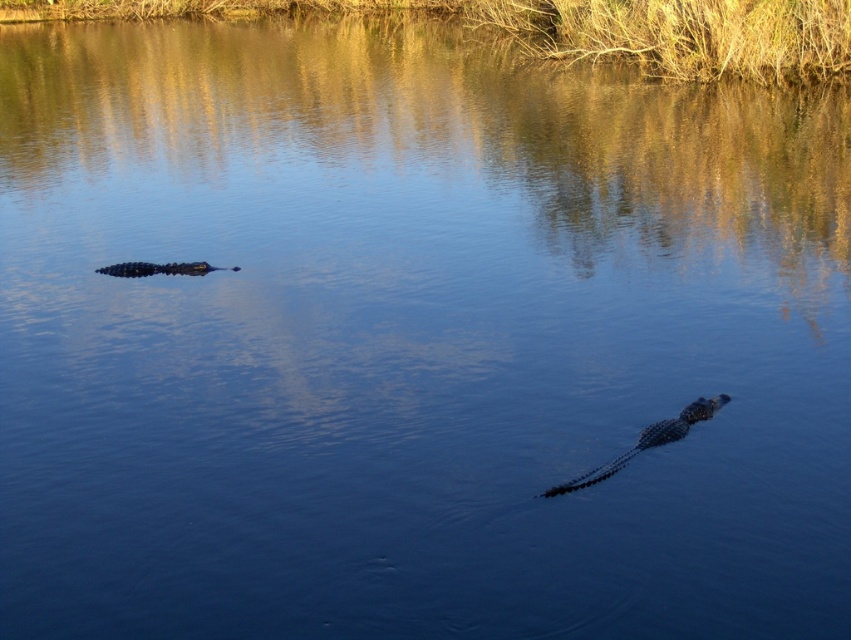
Can you confirm if shiny dark green crocodile at center is smaller than shiny black crocodile at left?

Actually, shiny dark green crocodile at center might be larger than shiny black crocodile at left.

Does shiny dark green crocodile at center have a lesser width compared to shiny black crocodile at left?

Correct, shiny dark green crocodile at center's width is less than shiny black crocodile at left's.

Where is `shiny dark green crocodile at center`? shiny dark green crocodile at center is located at coordinates (647, 442).